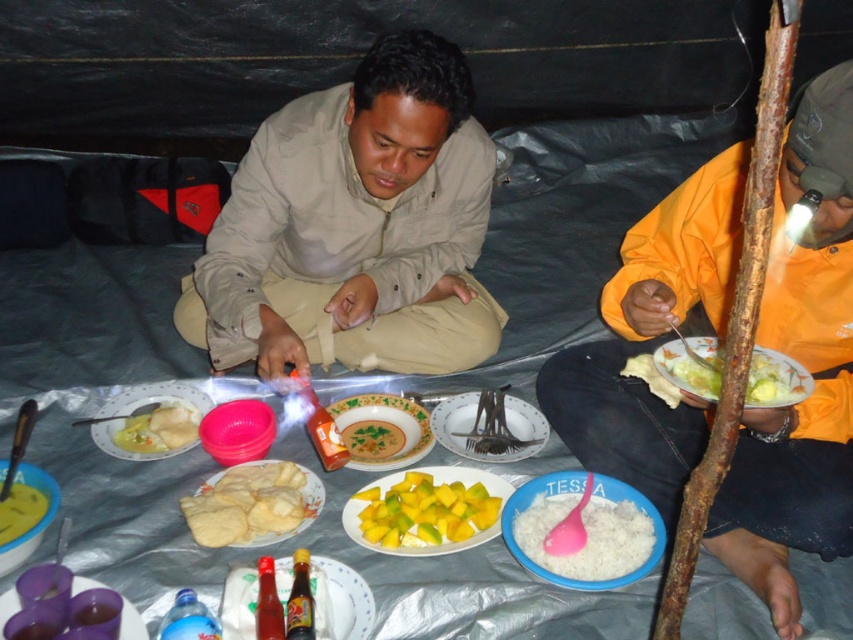
You are standing in front of the tent and want to take a photo of the two people inside. Which point, point (416, 554) or point (142, 394), would be closer to your camera lens when taking the photo?

Point (416, 554) is closer to the camera than point (142, 394), so it would be closer to your camera lens when taking the photo.

You are planning to place a new plate between the yellow matte plate at center and the matte white plate at center left. Based on their current positions, which plate should you move to make space?

The yellow matte plate at center is positioned under the matte white plate at center left, so you should move the matte white plate at center left to create space for the new plate.

You are planning to place a new item on the table. The white glossy plate at lower right is currently in front of the white matte bread at center. If you want to access the bread without moving the plate, where should you place the new item?

The white glossy plate at lower right is in front of the white matte bread at center, so to access the bread without moving the plate, you should place the new item behind the plate.